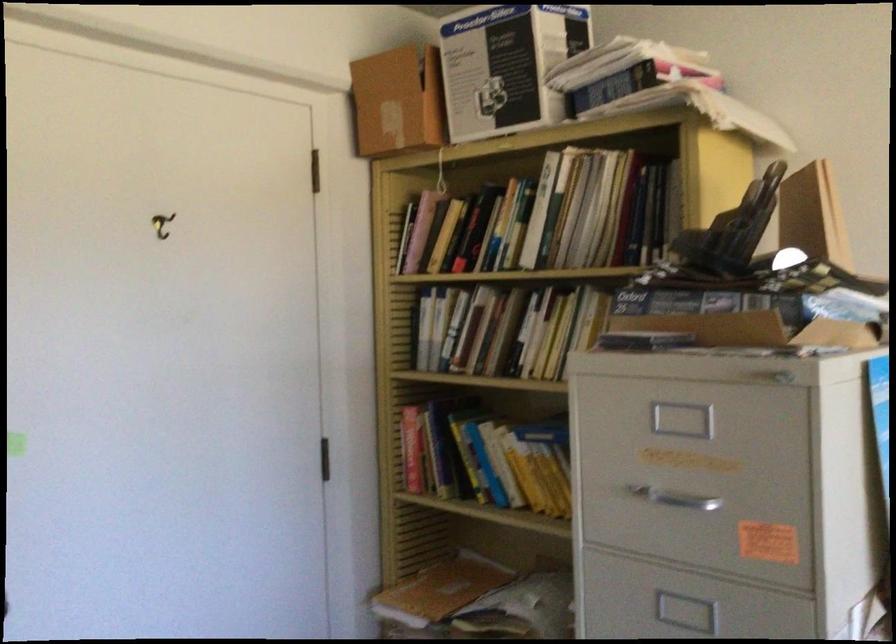
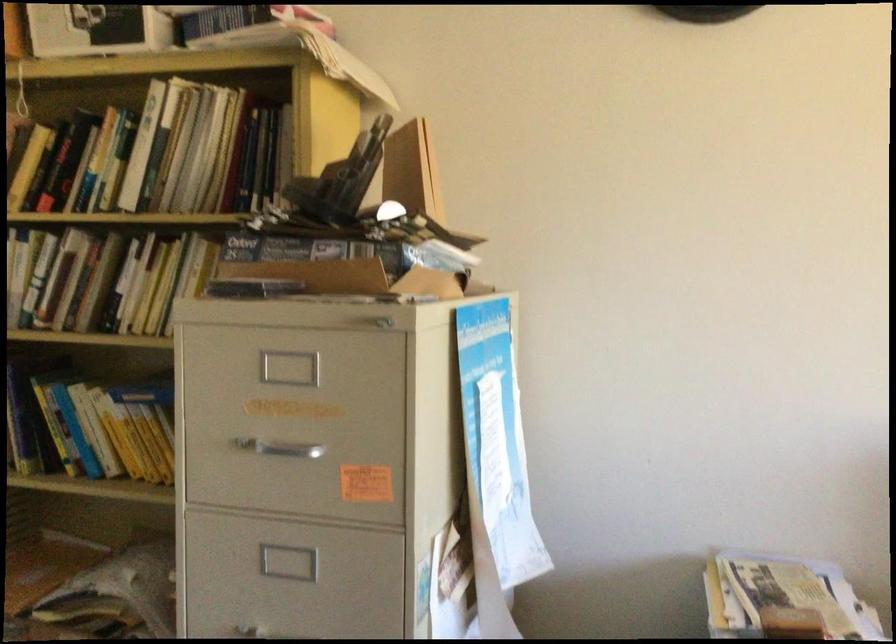
Question: What movement of the cameraman would produce the second image?

Choices:
 (A) Left
 (B) Right
 (C) Forward
 (D) Backward

Answer: (C)